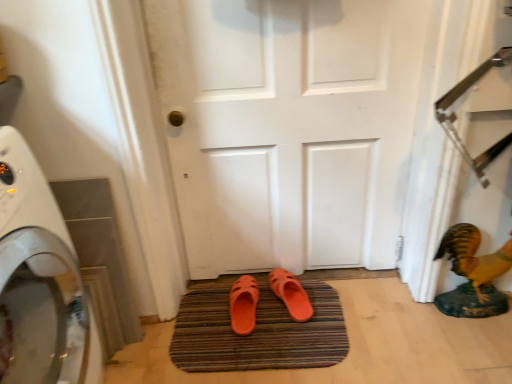
You are a GUI agent. You are given a task and a screenshot of the screen. Output one action in this format:
    pyautogui.click(x=<x>, y=<y>)
    Task: Click on the unoccupied region to the right of orange rubber slipper at center, the 2th footwear positioned from the left
    
    Given the screenshot: What is the action you would take?
    pyautogui.click(x=323, y=302)